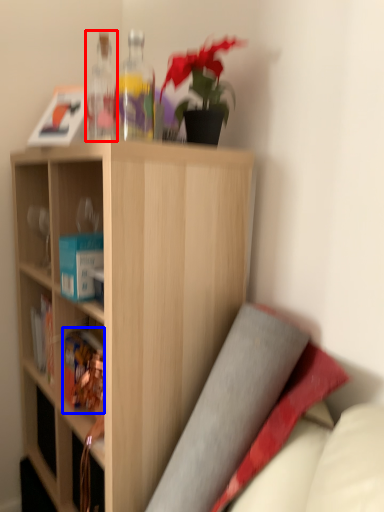
Question: Which point is further to the camera, bottle (highlighted by a red box) or book (highlighted by a blue box)?

Choices:
 (A) bottle
 (B) book

Answer: (B)